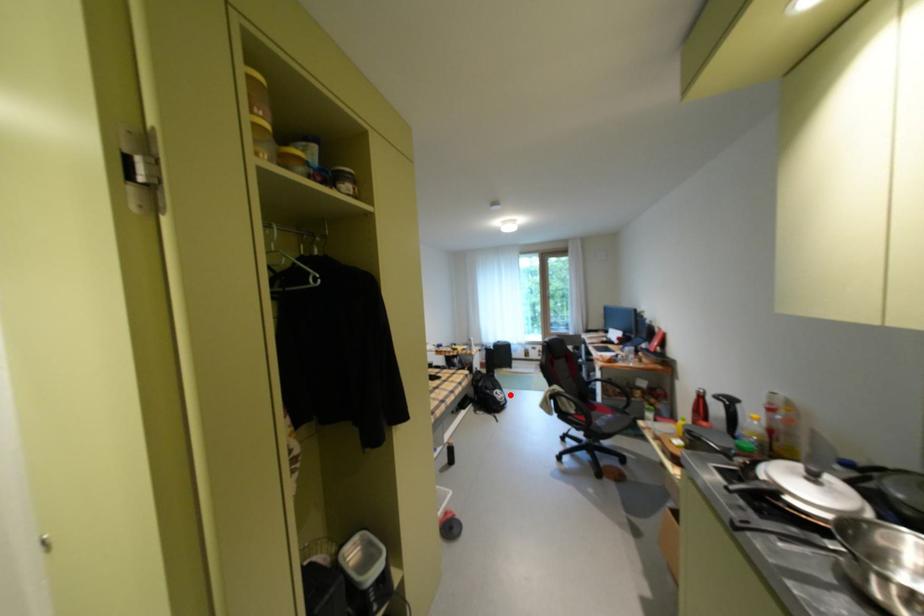
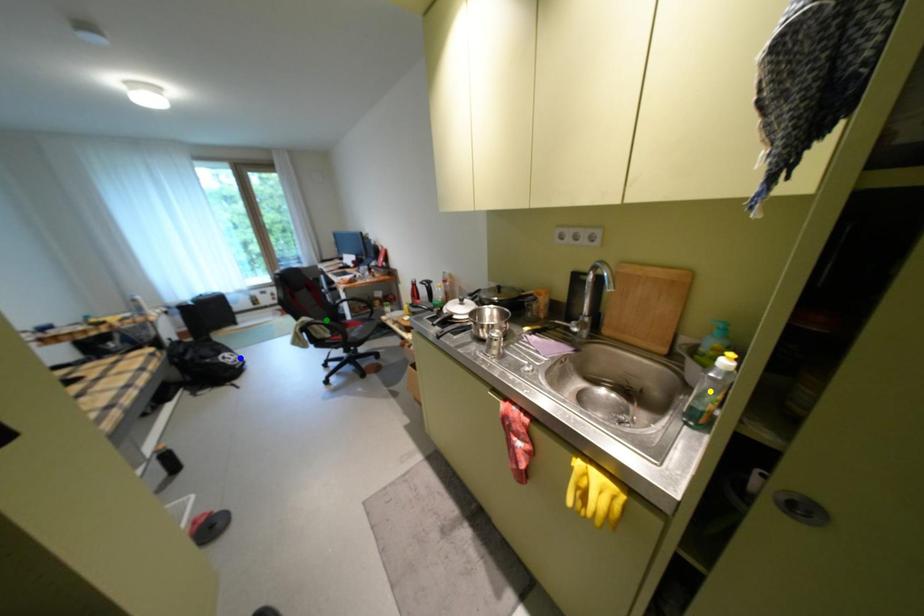
Question: I am providing you with two images of the same scene from different viewpoints. A red point is marked on the first image. You are given multiple points on the second image. Which point in image 2 is actually the same real-world point as the red point in image 1?

Choices:
 (A) green point
 (B) blue point
 (C) yellow point

Answer: (B)